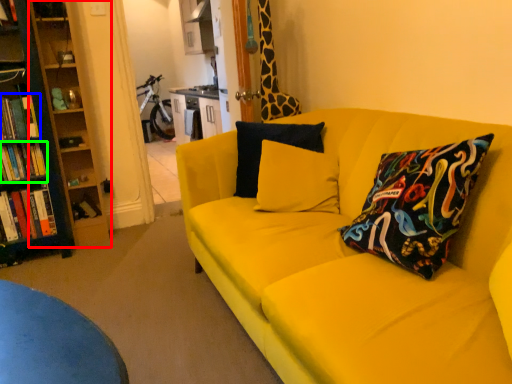
Question: Based on their relative distances, which object is nearer to bookshelf (highlighted by a red box)? Choose from book (highlighted by a blue box) and book (highlighted by a green box).

Choices:
 (A) book
 (B) book

Answer: (A)